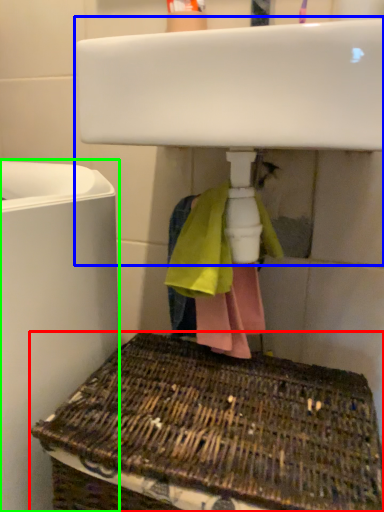
Question: Which is farther away from basket (highlighted by a red box)? sink (highlighted by a blue box) or appliance (highlighted by a green box)?

Choices:
 (A) sink
 (B) appliance

Answer: (A)